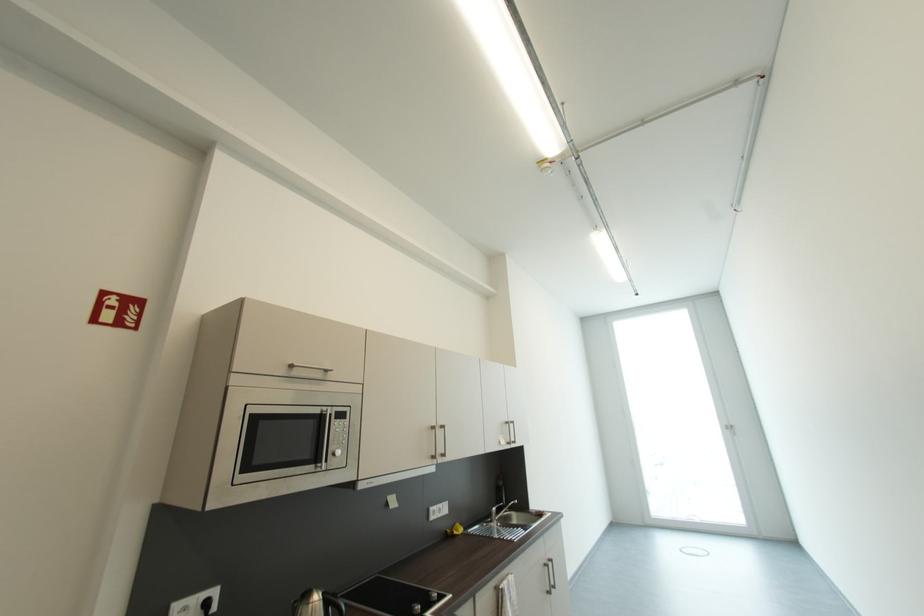
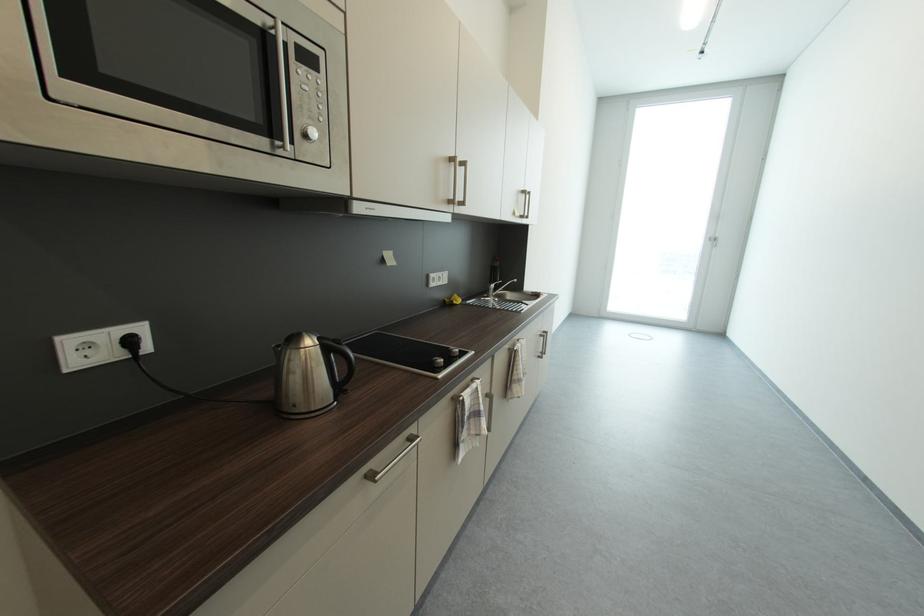
Question: Based on the continuous images, in which direction is the camera rotating? Reply with the corresponding letter.

Choices:
 (A) Left
 (B) Right
 (C) Up
 (D) Down

Answer: (D)